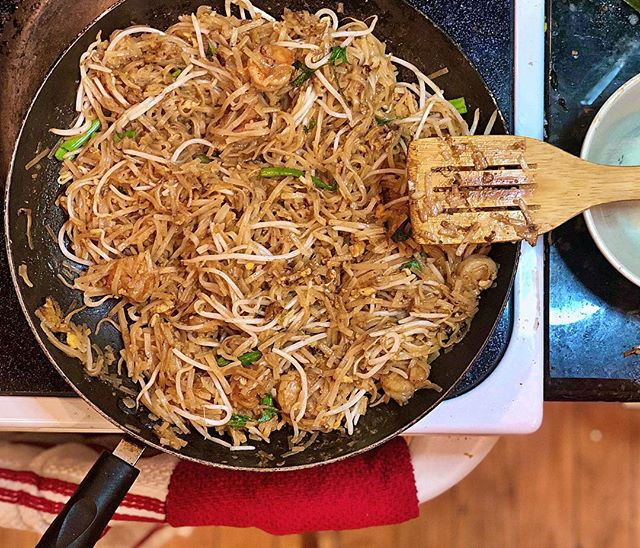
Find the location of a particular element. This screenshot has width=640, height=548. frying pan handle is located at coordinates (111, 493).